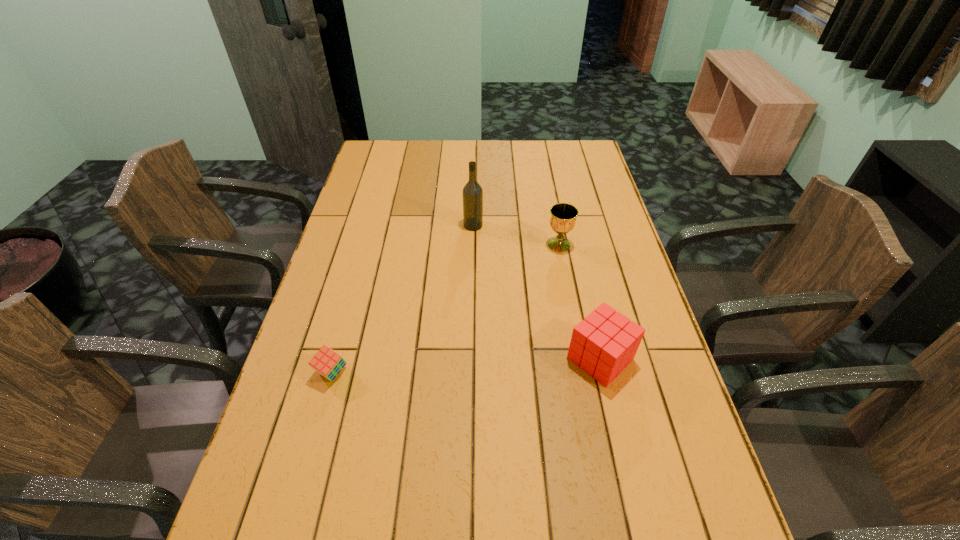
At what (x,y) coordinates should I click in order to perform the action: click on free location that satisfies the following two spatial constraints: 1. on the front side of the right cube; 2. on the right side of the vodka. Please return your answer as a coordinate pair (x, y). This screenshot has height=540, width=960. Looking at the image, I should click on (470, 359).